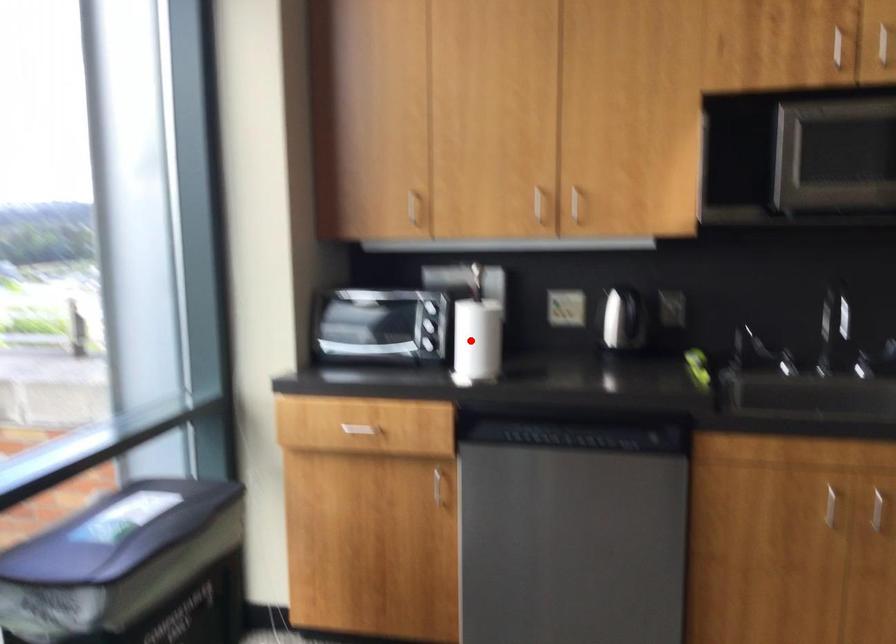
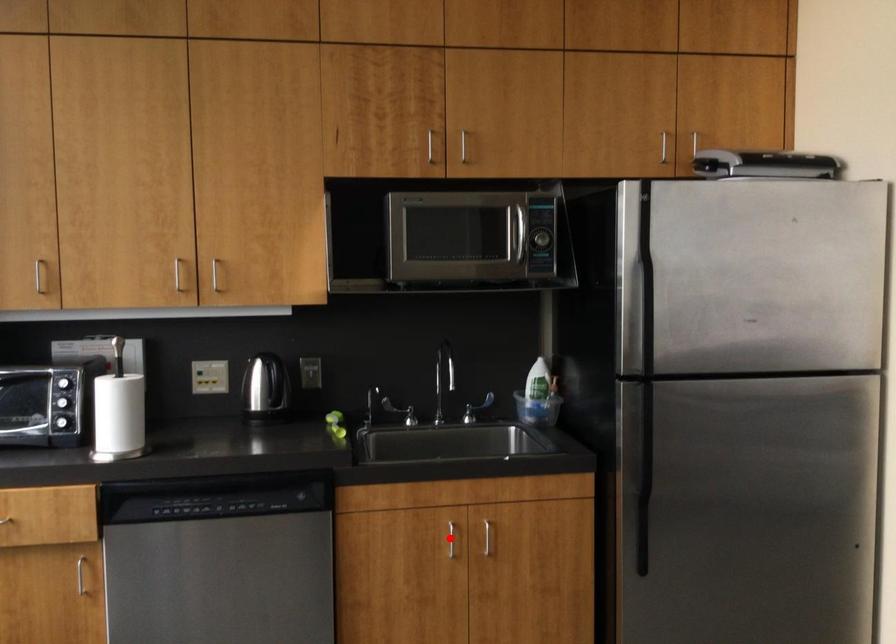
I am providing you with two images of the same scene from different viewpoints. A red point is marked on the first image and another point is marked on the second image. Do the highlighted points in image1 and image2 indicate the same real-world spot?

No